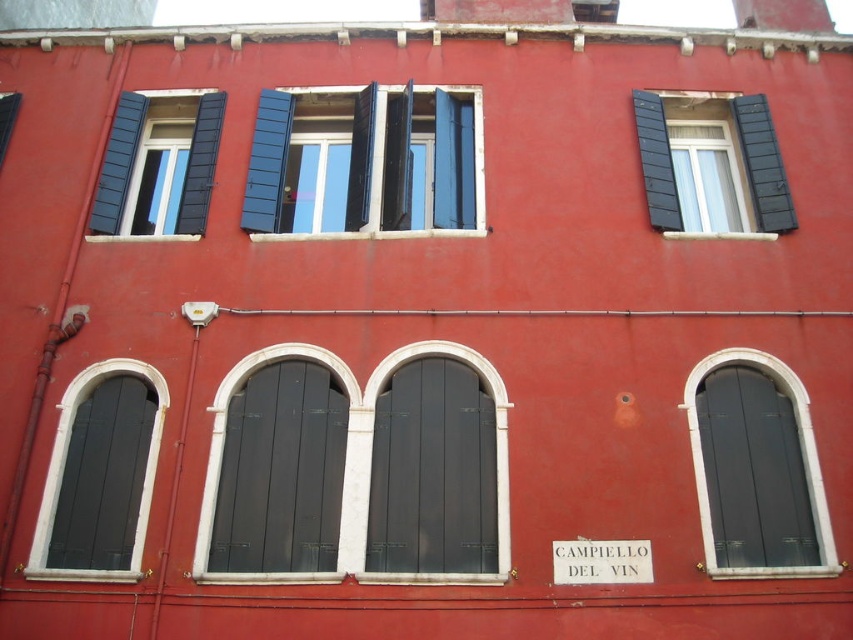
Question: Does black matte wood window at center have a lesser width compared to matte black window at center?

Choices:
 (A) no
 (B) yes

Answer: (A)

Question: Which of the following is the closest to the observer?

Choices:
 (A) matte black door at center
 (B) black matte wood window at center
 (C) matte black window at lower right

Answer: (A)

Question: Estimate the real-world distances between objects in this image. Which object is closer to the matte black shutters at upper right?

Choices:
 (A) matte black door at center
 (B) black matte window at left
 (C) black matte wood window at center

Answer: (A)

Question: Based on their relative distances, which object is nearer to the matte black window at lower right?

Choices:
 (A) matte black shutters at upper right
 (B) matte black window at center

Answer: (A)

Question: Is matte black door at center to the right of black matte window at left from the viewer's perspective?

Choices:
 (A) yes
 (B) no

Answer: (A)

Question: Is black matte wood window at center thinner than matte black shutters at upper right?

Choices:
 (A) yes
 (B) no

Answer: (B)